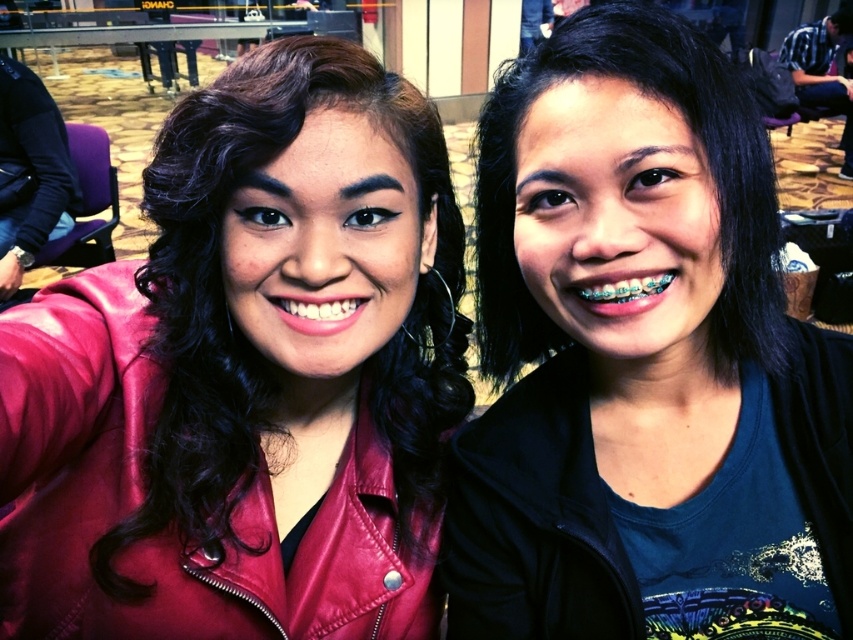
Is matte leather jacket at left below white glossy teeth at center?

Yes, matte leather jacket at left is below white glossy teeth at center.

Which is above, matte leather jacket at left or white glossy teeth at center?

white glossy teeth at center is higher up.

Describe the element at coordinates (247, 376) in the screenshot. This screenshot has height=640, width=853. I see `matte leather jacket at left` at that location.

Find the location of `matte leather jacket at left`. matte leather jacket at left is located at coordinates (247, 376).

Locate an element on the screen. Image resolution: width=853 pixels, height=640 pixels. blue matte shirt at center is located at coordinates (630, 337).

Between white glossy teeth at center and teethmetallicmouth at right, which one is positioned lower?

white glossy teeth at center

Is white glossy teeth at center closer to camera compared to teethmetallicmouth at right?

No.

Does point (317, 289) come closer to viewer compared to point (670, 272)?

That is False.

Find the location of `white glossy teeth at center`. white glossy teeth at center is located at coordinates (317, 312).